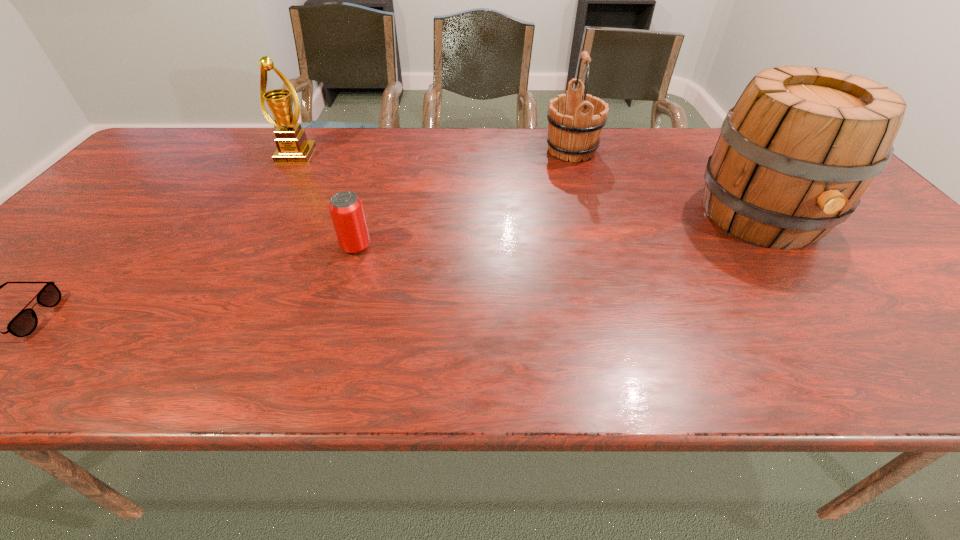
Locate an element on the screen. The width and height of the screenshot is (960, 540). free point between the fourth object from left to right and the cider is located at coordinates (667, 184).

Where is `vacant area between the third object from left to right and the award`? vacant area between the third object from left to right and the award is located at coordinates (326, 201).

Locate an element on the screen. This screenshot has height=540, width=960. object that ranks as the closest to the cider is located at coordinates (575, 126).

Point out which object is positioned as the nearest to the rightmost object. Please provide its 2D coordinates. Your answer should be formatted as a tuple, i.e. [(x, y)], where the tuple contains the x and y coordinates of a point satisfying the conditions above.

[(575, 126)]

Locate an element on the screen. vacant area that satisfies the following two spatial constraints: 1. on the front-facing side of the second object from left to right; 2. on the right side of the third object from right to left is located at coordinates (243, 247).